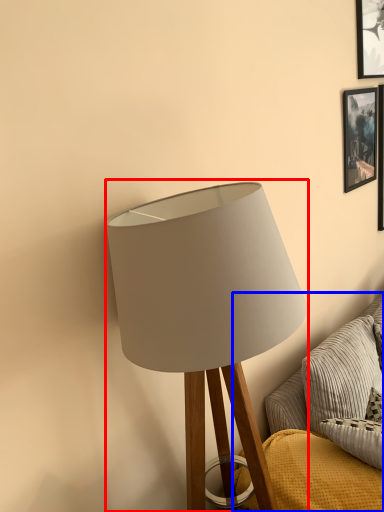
Question: Among these objects, which one is nearest to the camera, lamp (highlighted by a red box) or couch (highlighted by a blue box)?

Choices:
 (A) lamp
 (B) couch

Answer: (A)